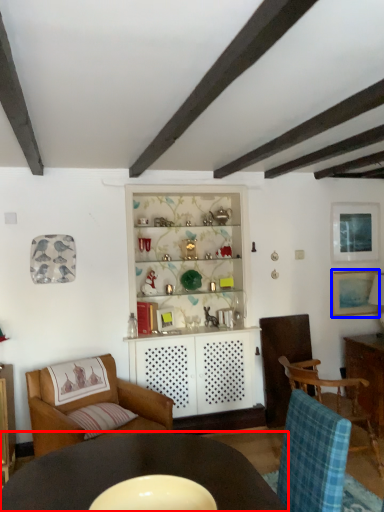
Question: Which of the following is the farthest to the observer, table (highlighted by a red box) or picture frame (highlighted by a blue box)?

Choices:
 (A) table
 (B) picture frame

Answer: (B)